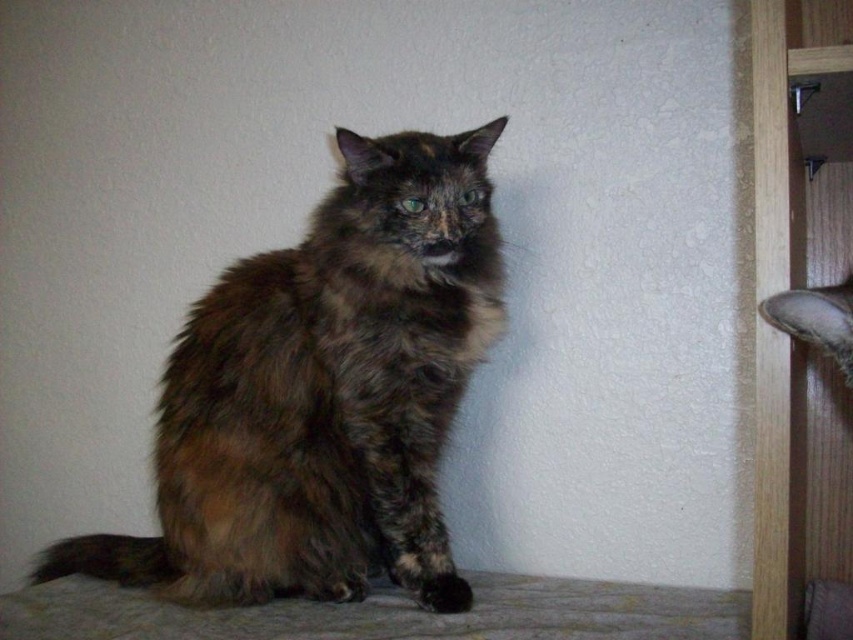
Which is more to the right, brown fur cat at center or brown shaggy cat at right?

brown shaggy cat at right is more to the right.

Is brown fur cat at center below brown shaggy cat at right?

Correct, brown fur cat at center is located below brown shaggy cat at right.

Which is in front, point (473, 262) or point (799, 337)?

Point (799, 337) is more forward.

The image size is (853, 640). Identify the location of brown fur cat at center. (323, 394).